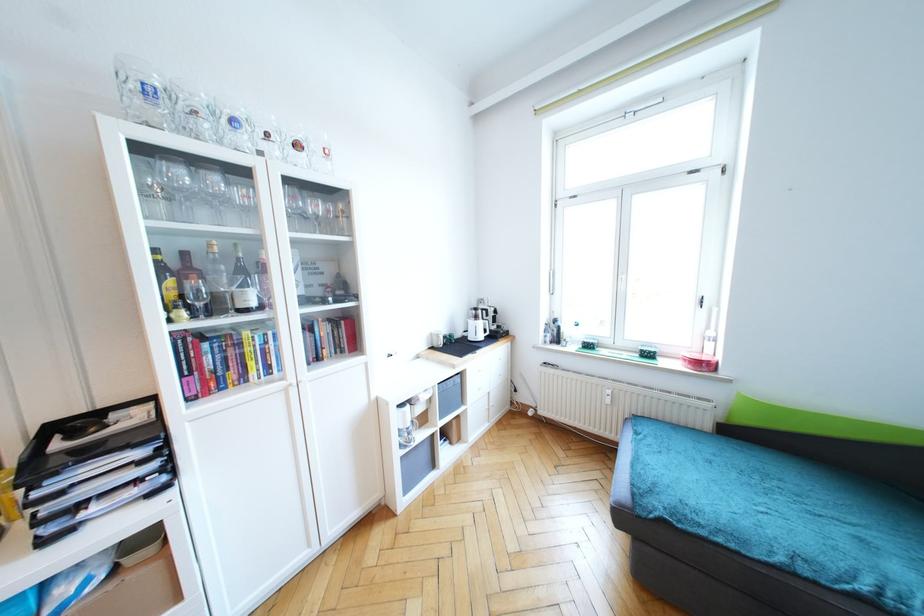
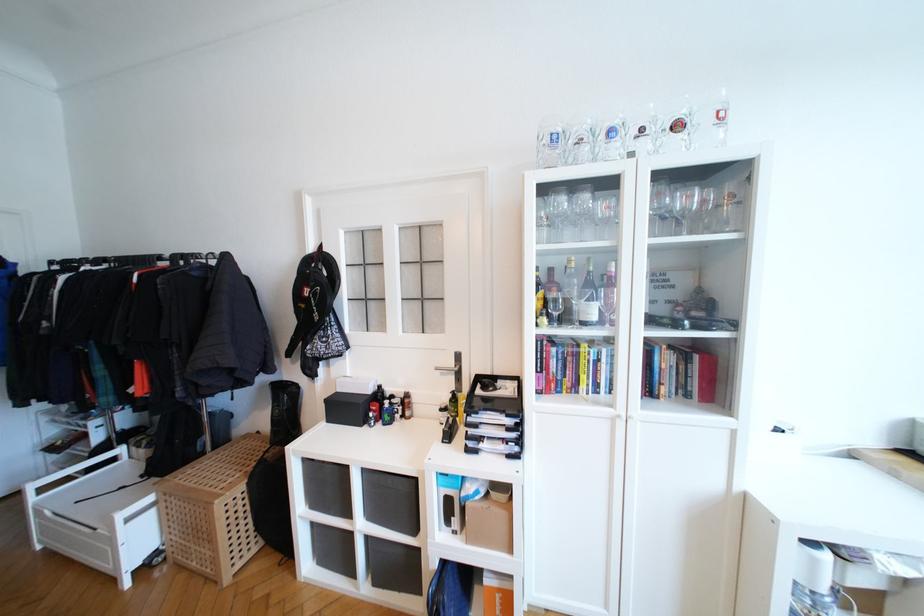
In the second image, find the point that corresponds to pixel 320 208 in the first image.

(691, 200)